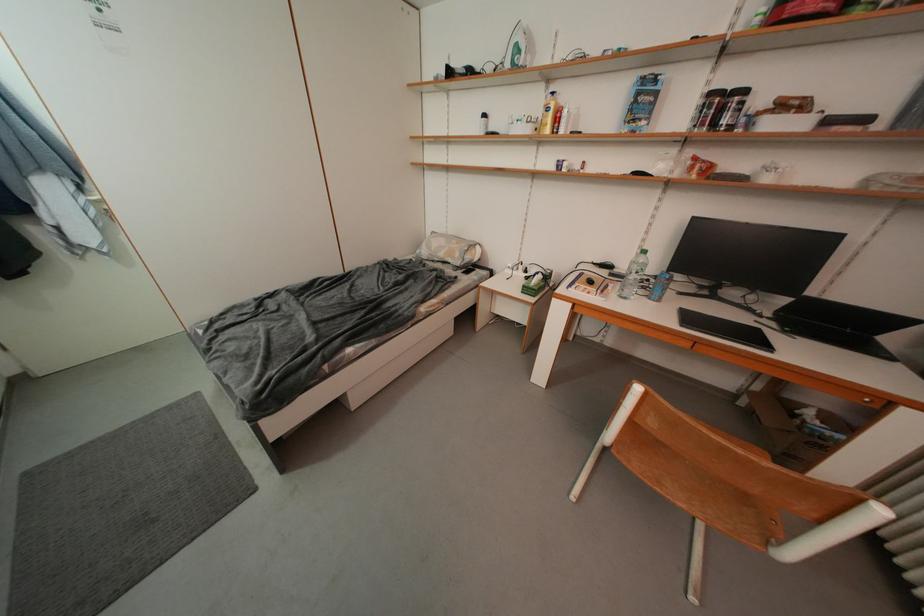
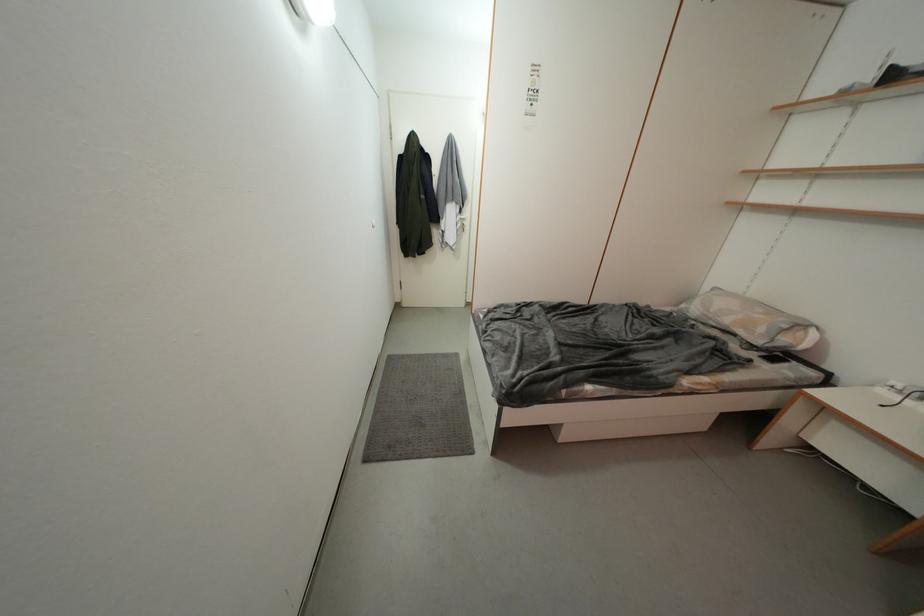
Where in the second image is the point corresponding to point 465,257 from the first image?

(769, 333)